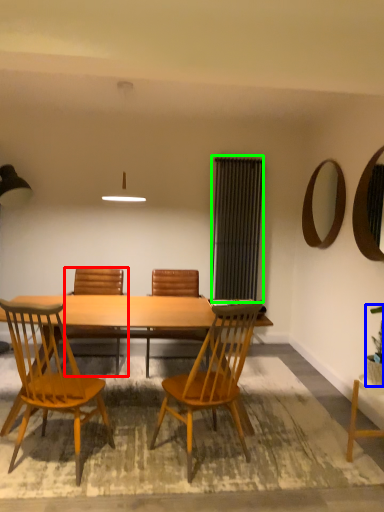
Question: Which object is the closest to the chair (highlighted by a red box)? Choose among these: houseplant (highlighted by a blue box) or screen door (highlighted by a green box).

Choices:
 (A) houseplant
 (B) screen door

Answer: (B)